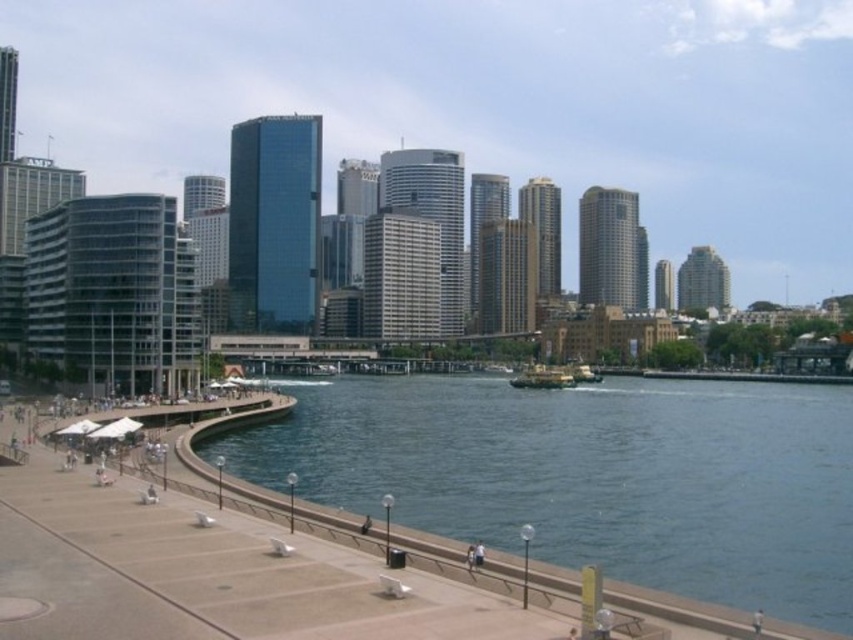
You are standing at the point with coordinates point (566, 368) and want to walk to the point with coordinates point (798, 412). Based on the scene description, which direction should you move relative to your current position?

You should move forward because point (798, 412) is in front of point (566, 368) according to the spatial relationship provided.